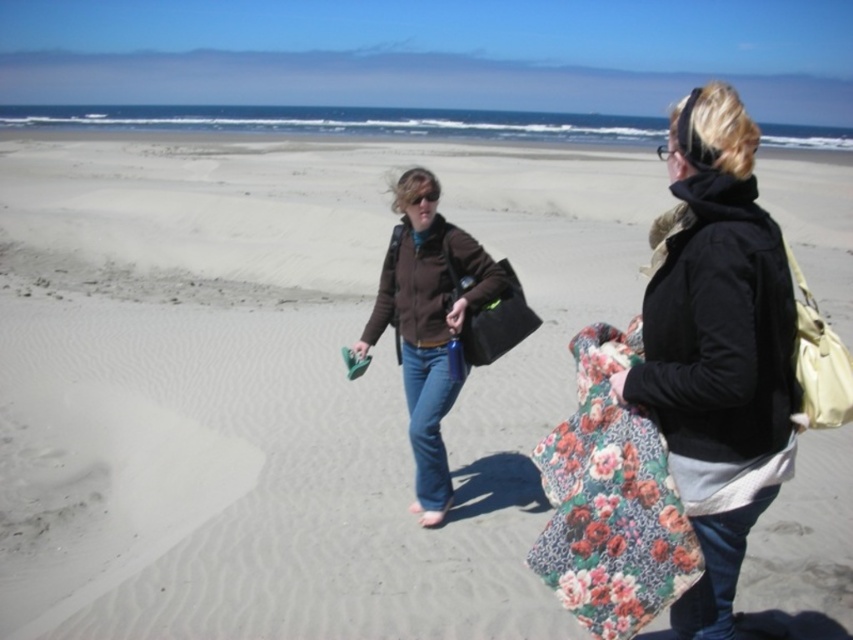
You are a photographer trying to capture the two people on the beach. You notice the floral fabric blanket at center and the matte black bag at center. Which object should you focus on if you want to include the one that is higher in the frame?

The floral fabric blanket at center is above the matte black bag at center, so you should focus on the floral fabric blanket at center to capture the higher object in the frame.